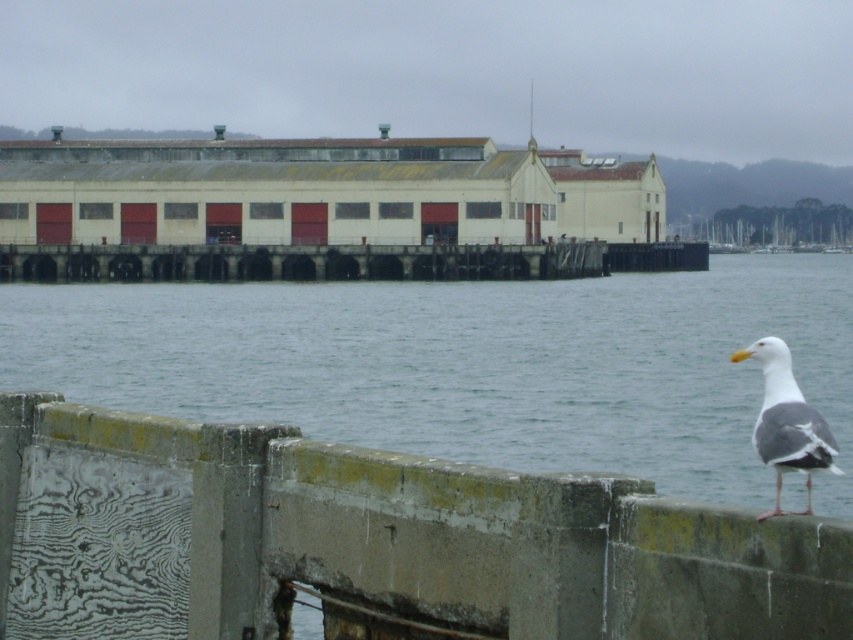
Find the location of `weathered wood dock at center`. weathered wood dock at center is located at coordinates (343, 260).

Does weathered wood dock at center have a lesser width compared to white feathered seagull at lower right?

No.

Between point (509, 275) and point (775, 490), which one is positioned in front?

Point (775, 490) is more forward.

The image size is (853, 640). What are the coordinates of `weathered wood dock at center` in the screenshot? It's located at (343, 260).

Is clear water at lower center thinner than white feathered seagull at lower right?

No, clear water at lower center is not thinner than white feathered seagull at lower right.

In the scene shown: Is clear water at lower center above white feathered seagull at lower right?

Indeed, clear water at lower center is positioned over white feathered seagull at lower right.

Is point (572, 433) positioned after point (793, 436)?

Yes, point (572, 433) is behind point (793, 436).

Image resolution: width=853 pixels, height=640 pixels. Find the location of `clear water at lower center`. clear water at lower center is located at coordinates (469, 364).

Looking at this image, can you confirm if wooden textured rail at lower right is smaller than clear water at lower center?

Yes.

Describe the element at coordinates (373, 541) in the screenshot. Image resolution: width=853 pixels, height=640 pixels. I see `wooden textured rail at lower right` at that location.

The width and height of the screenshot is (853, 640). What do you see at coordinates (373, 541) in the screenshot? I see `wooden textured rail at lower right` at bounding box center [373, 541].

Where is `wooden textured rail at lower right`? This screenshot has width=853, height=640. wooden textured rail at lower right is located at coordinates (373, 541).